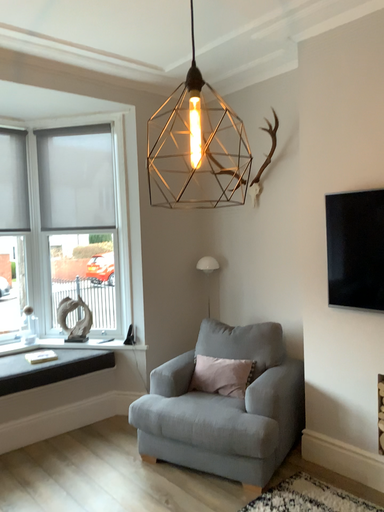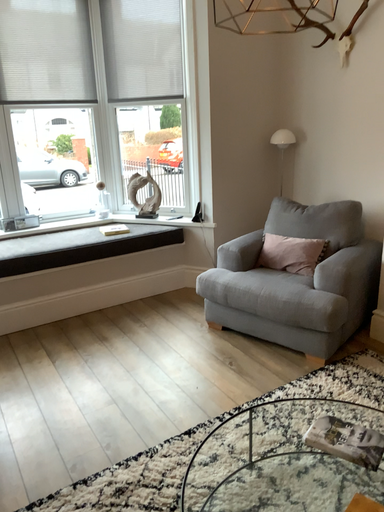
Question: How did the camera likely rotate when shooting the video?

Choices:
 (A) rotated right
 (B) rotated left

Answer: (B)